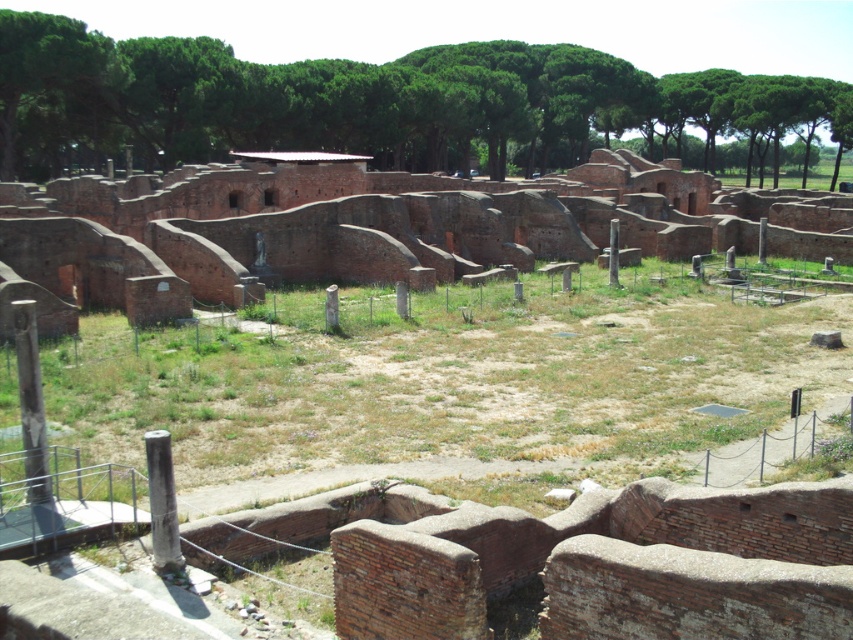
Question: Can you confirm if green grass at center is positioned below gray stone pillar at lower left?

Choices:
 (A) no
 (B) yes

Answer: (A)

Question: Is green leafy trees at upper center further to the viewer compared to gray stone pillar at lower left?

Choices:
 (A) yes
 (B) no

Answer: (A)

Question: Among these points, which one is farthest from the camera?

Choices:
 (A) (550, 180)
 (B) (498, 112)

Answer: (B)

Question: Which of the following is the farthest from the observer?

Choices:
 (A) brick wall at center
 (B) gray stone pillar at lower left

Answer: (A)

Question: Which point is farther from the camera taking this photo?

Choices:
 (A) (36, 428)
 (B) (271, 86)
 (C) (618, 346)

Answer: (B)

Question: Is green leafy trees at upper center bigger than gray stone pillar at lower left?

Choices:
 (A) yes
 (B) no

Answer: (A)